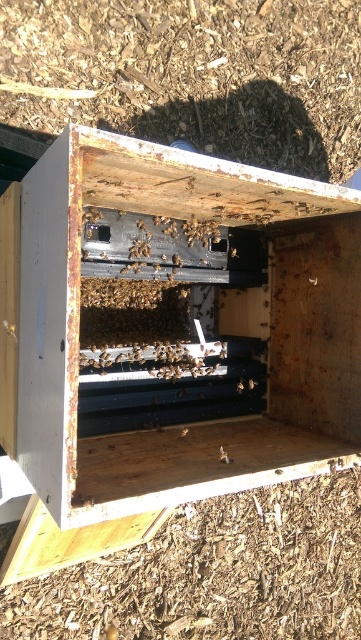
Question: Among these objects, which one is nearest to the camera?

Choices:
 (A) rusty metal beehive at center
 (B) translucent yellowish honeycomb at center

Answer: (A)

Question: Does translucent yellowish bee at center appear over translucent yellowish honeycomb at center?

Choices:
 (A) no
 (B) yes

Answer: (A)

Question: Can you confirm if rusty metal beehive at center is positioned above translucent yellowish honeycomb at center?

Choices:
 (A) no
 (B) yes

Answer: (B)

Question: Based on their relative distances, which object is nearer to the translucent yellowish honeycomb at center?

Choices:
 (A) rusty metal beehive at center
 (B) translucent yellowish bee at center

Answer: (B)

Question: Does translucent yellowish bee at center appear over translucent yellowish honeycomb at center?

Choices:
 (A) yes
 (B) no

Answer: (B)

Question: Which point is farther from the camera taking this photo?

Choices:
 (A) (184, 429)
 (B) (225, 461)
 (C) (84, 378)

Answer: (A)